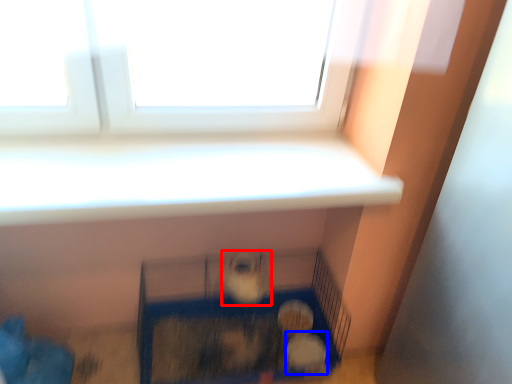
Question: Which object is closer to the camera taking this photo, animal (highlighted by a red box) or animal (highlighted by a blue box)?

Choices:
 (A) animal
 (B) animal

Answer: (A)